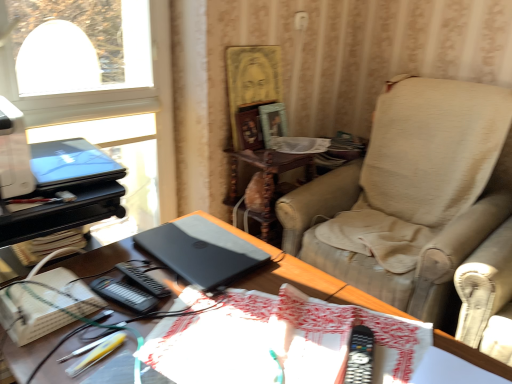
This screenshot has height=384, width=512. Find the location of `unoccupied area in front of white cardboard book at lower left`. unoccupied area in front of white cardboard book at lower left is located at coordinates (41, 355).